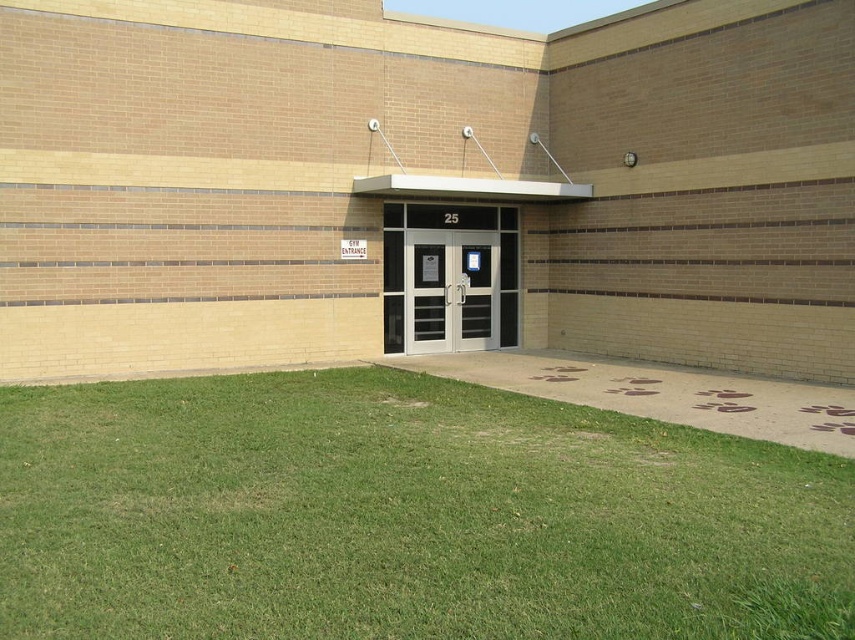
Question: Estimate the real-world distances between objects in this image. Which object is closer to the white glass door at center?

Choices:
 (A) matte black door at center
 (B) white glass doors at center

Answer: (B)

Question: Considering the relative positions of white glass door at center and matte black door at center in the image provided, where is white glass door at center located with respect to matte black door at center?

Choices:
 (A) below
 (B) above

Answer: (A)

Question: Which object is the farthest from the white glass door at center?

Choices:
 (A) green grass at lower left
 (B) white glass doors at center
 (C) matte black door at center

Answer: (A)

Question: Does green grass at lower left have a greater width compared to white glass door at center?

Choices:
 (A) yes
 (B) no

Answer: (A)

Question: Can you confirm if white glass door at center is thinner than matte black door at center?

Choices:
 (A) yes
 (B) no

Answer: (B)

Question: Which point appears farthest from the camera in this image?

Choices:
 (A) (419, 289)
 (B) (490, 230)
 (C) (646, 490)
 (D) (472, 317)

Answer: (B)